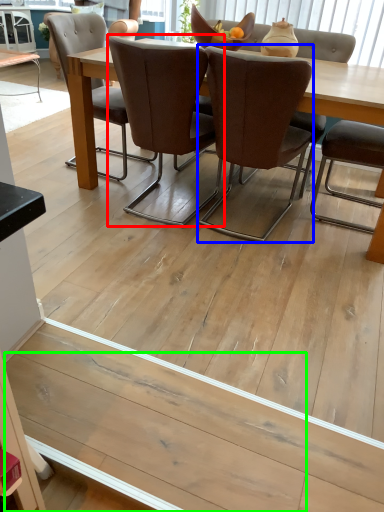
Question: Considering the real-world distances, which object is farthest from chair (highlighted by a red box)? chair (highlighted by a blue box) or plank (highlighted by a green box)?

Choices:
 (A) chair
 (B) plank

Answer: (B)